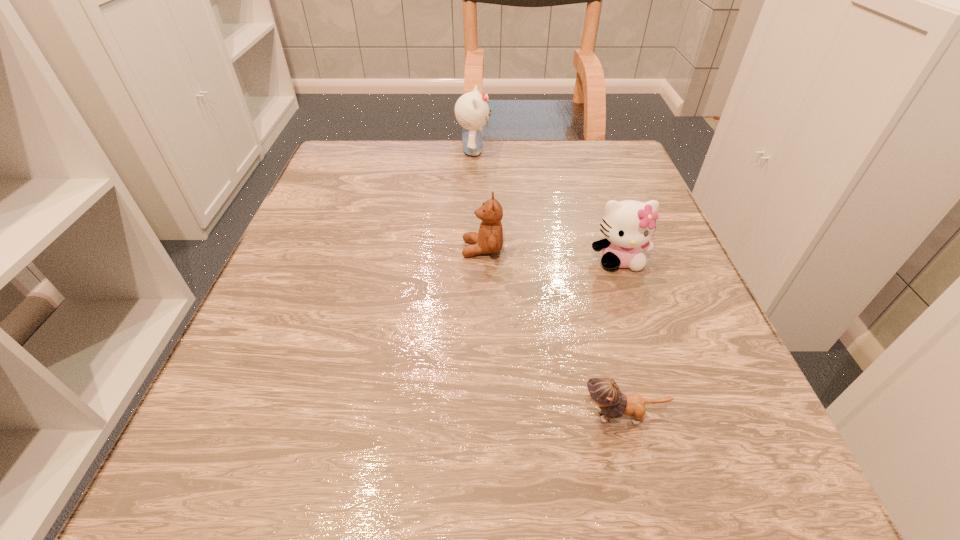
Locate an element on the screen. This screenshot has width=960, height=540. vacant space situated on the face of the teddy bear is located at coordinates (312, 249).

Find the location of `vacant space located 0.160m on the front-facing side of the nearest kitten`. vacant space located 0.160m on the front-facing side of the nearest kitten is located at coordinates (452, 416).

Where is `free spot located 0.390m on the front-facing side of the nearest kitten`? free spot located 0.390m on the front-facing side of the nearest kitten is located at coordinates (270, 416).

I want to click on free location located on the front-facing side of the nearest kitten, so click(365, 416).

Locate an element on the screen. The width and height of the screenshot is (960, 540). object located in the far edge section of the desktop is located at coordinates (472, 112).

In the image, there is a desktop. Identify the location of vacant space at the far edge. (527, 139).

Locate an element on the screen. This screenshot has width=960, height=540. free spot at the left edge of the desktop is located at coordinates (256, 299).

This screenshot has height=540, width=960. In the image, there is a desktop. Find the location of `vacant space at the right edge`. vacant space at the right edge is located at coordinates (632, 328).

In the image, there is a desktop. In order to click on blank space at the far left corner in this screenshot , I will do `click(380, 139)`.

In order to click on free point at the far right corner in this screenshot , I will do `click(618, 187)`.